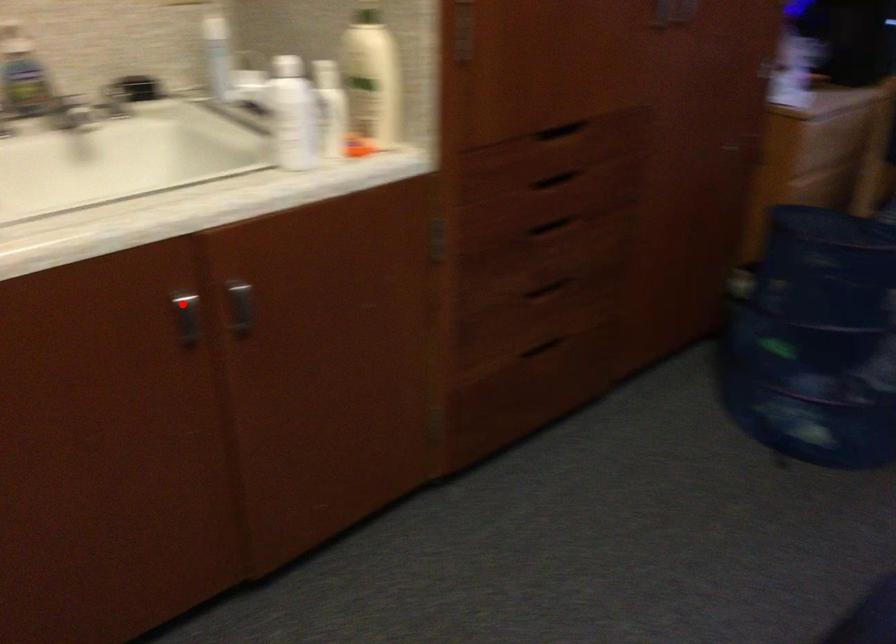
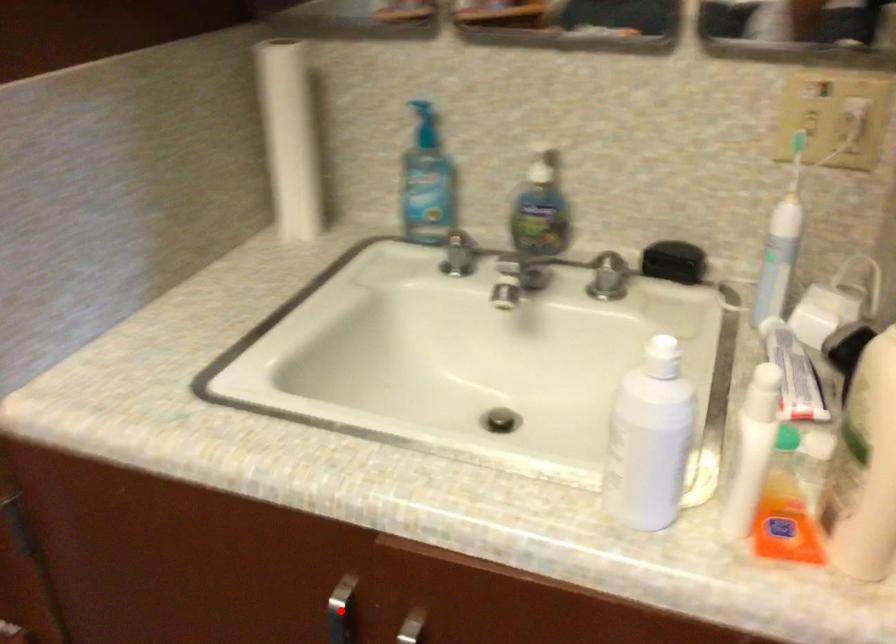
I am providing you with two images of the same scene from different viewpoints. A red point is marked on the first image and another point is marked on the second image. Is the marked point in image1 the same physical position as the marked point in image2?

Yes